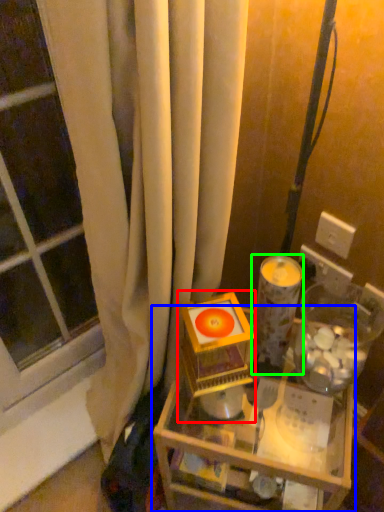
Question: Based on their relative distances, which object is farther from toy (highlighted by a red box)? Choose from table (highlighted by a blue box) and candle holder (highlighted by a green box).

Choices:
 (A) table
 (B) candle holder

Answer: (A)